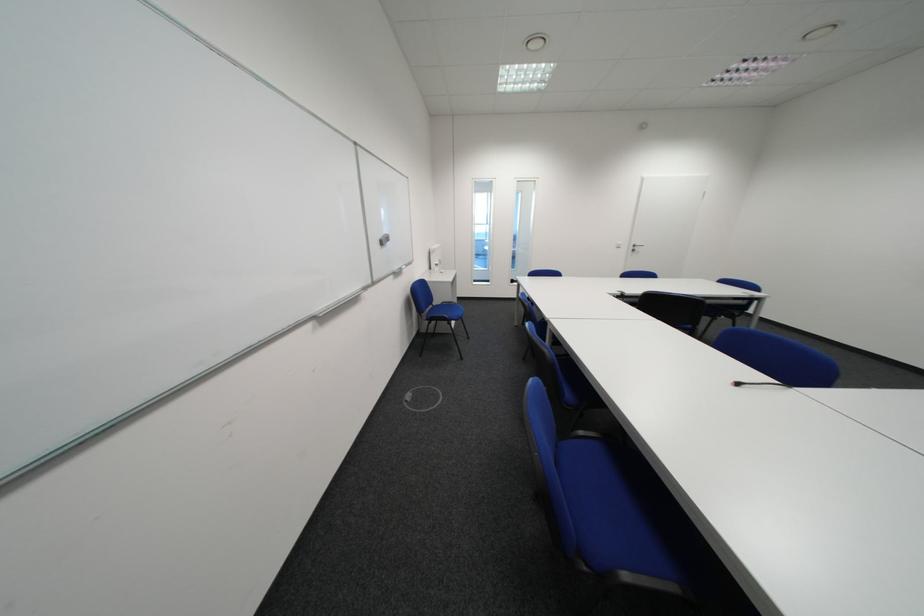
You are a GUI agent. You are given a task and a screenshot of the screen. Output one action in this format:
    pyautogui.click(x=<x>, y=<y>)
    Task: Click on the silver door handle
    The width and height of the screenshot is (924, 616).
    Given the screenshot: What is the action you would take?
    pyautogui.click(x=636, y=246)